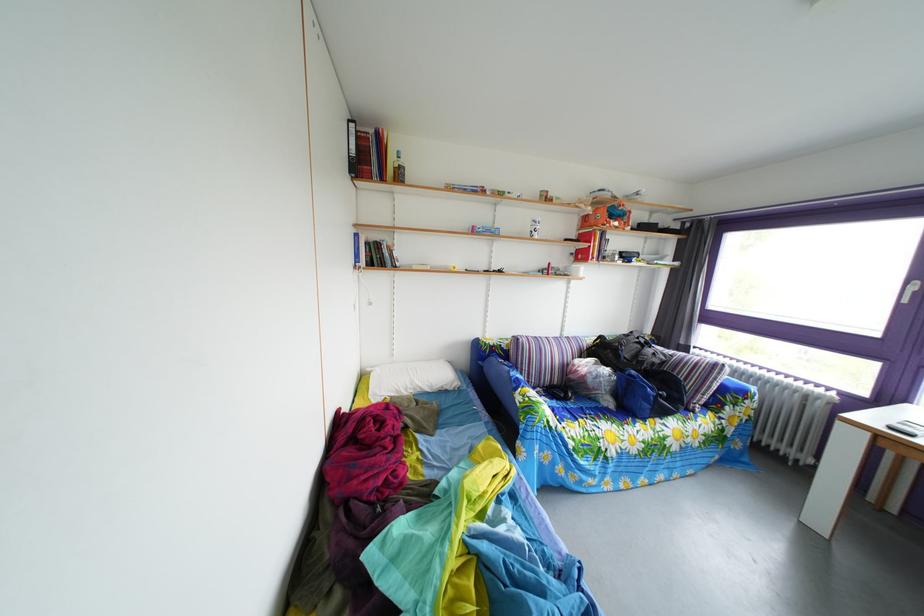
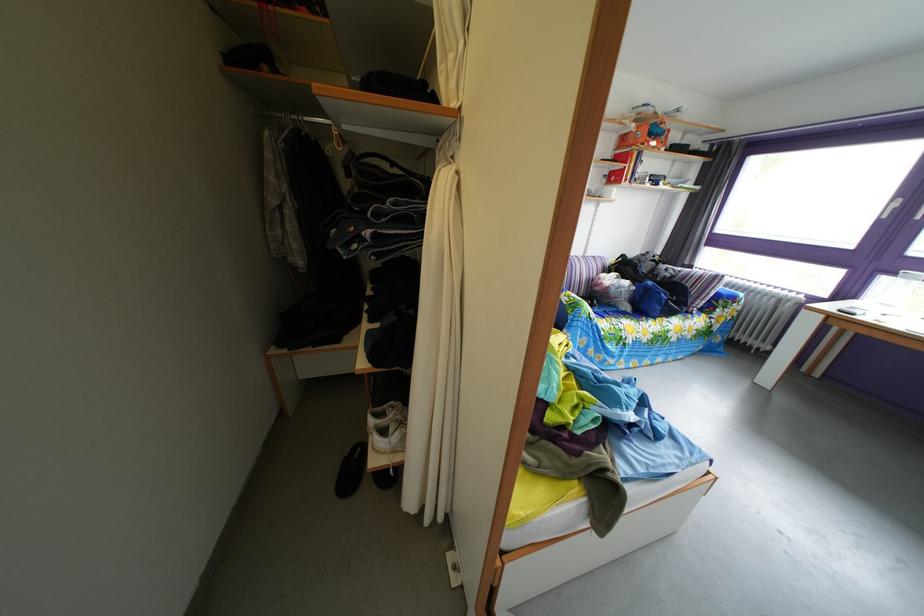
The point at (619, 411) is marked in the first image. Where is the corresponding point in the second image?

(638, 315)